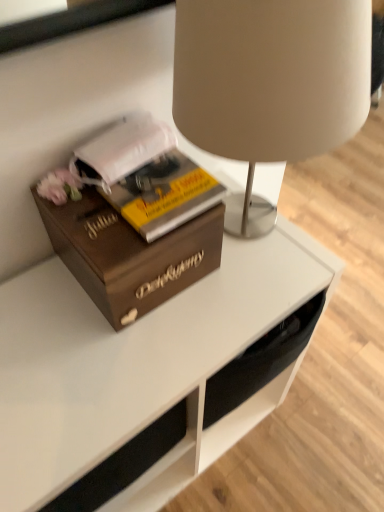
In order to click on free space in front of white matte book at left in this screenshot , I will do `click(110, 226)`.